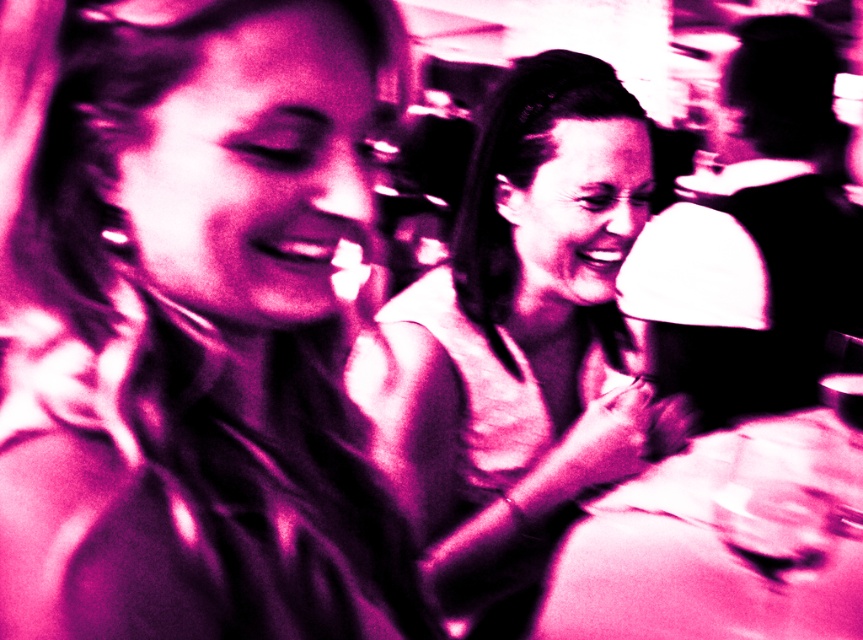
Is point (118, 342) positioned in front of point (561, 205)?

Yes, it is.

Can you confirm if matte pink shirt at upper left is positioned to the left of matte white blouse at center?

Indeed, matte pink shirt at upper left is positioned on the left side of matte white blouse at center.

What are the coordinates of `matte pink shirt at upper left` in the screenshot? It's located at (187, 324).

Can you confirm if matte white blouse at center is taller than transparent plastic wine glass at lower right?

Yes, matte white blouse at center is taller than transparent plastic wine glass at lower right.

Between point (512, 77) and point (775, 579), which one is positioned in front?

Point (775, 579) is more forward.

The width and height of the screenshot is (863, 640). Identify the location of matte white blouse at center. (520, 339).

Is matte pink shirt at upper left to the right of transparent plastic wine glass at lower right from the viewer's perspective?

In fact, matte pink shirt at upper left is to the left of transparent plastic wine glass at lower right.

Between point (60, 356) and point (765, 477), which one is positioned in front?

Point (60, 356)

This screenshot has height=640, width=863. Find the location of `matte pink shirt at upper left`. matte pink shirt at upper left is located at coordinates (187, 324).